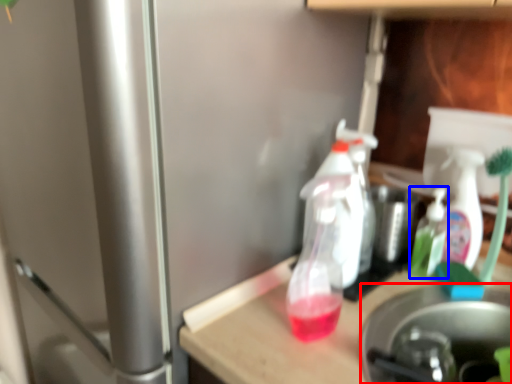
Question: Which object appears closest to the camera in this image, appliance (highlighted by a red box) or bottle (highlighted by a blue box)?

Choices:
 (A) appliance
 (B) bottle

Answer: (A)